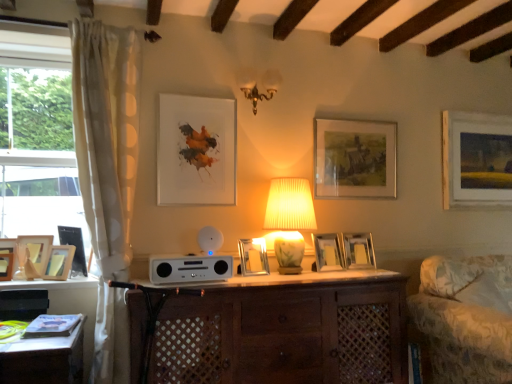
Question: In terms of size, does metallic silver picture frame at center, arranged as the 4th picture frame when viewed from the right, appear bigger or smaller than white glossy stereo at center?

Choices:
 (A) small
 (B) big

Answer: (A)

Question: Is metallic silver picture frame at center, arranged as the 4th picture frame when viewed from the right, to the left or to the right of white glossy stereo at center in the image?

Choices:
 (A) left
 (B) right

Answer: (B)

Question: Based on their relative distances, which object is farther from the patterned fabric swivel chair at right?

Choices:
 (A) matte wooden picture frame at center, which ranks as the 2th picture frame in right-to-left order
 (B) metallic silver picture frame at center, positioned as the third picture frame in right-to-left order
 (C) matte paper picture frame at upper center, placed as the fifth picture frame when sorted from left to right
 (D) wooden picture frame at left, the ninth picture frame in the right-to-left sequence
 (E) wooden picture frame at left, which is the first picture frame from left to right

Answer: (E)

Question: Which object is positioned closest to the metallic silver picture frame at center, arranged as the 4th picture frame when viewed from the right?

Choices:
 (A) wooden picture frame at left, the 10th picture frame from the right
 (B) matte wooden picture frame at center, which ranks as the 2th picture frame in right-to-left order
 (C) matte paper picture frame at upper center, the 6th picture frame from the right
 (D) brown wooden cabinet at center
 (E) metallic silver picture frame at center, positioned as the third picture frame in right-to-left order

Answer: (E)